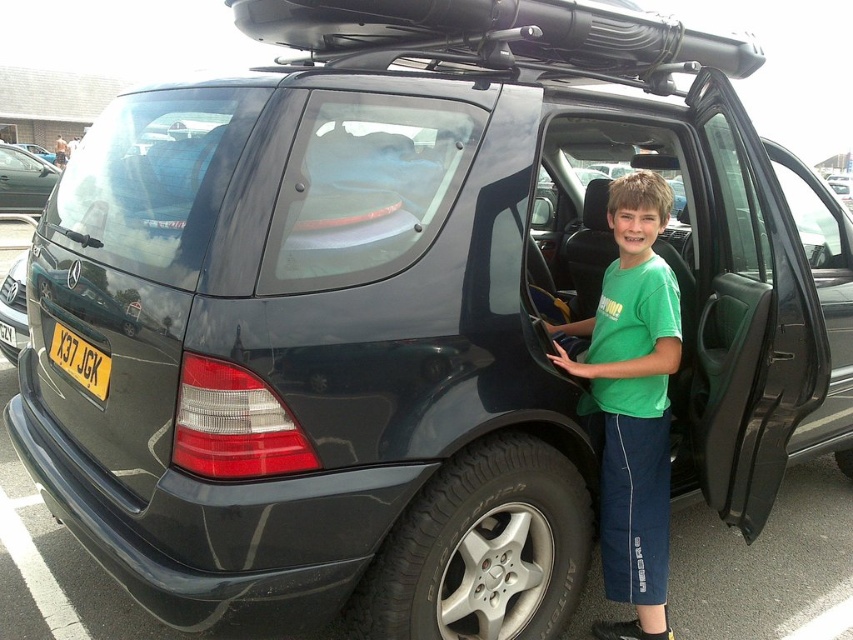
Does metallic silver car at left have a larger size compared to yellow plastic license plate at rear?

Yes.

Does point (41, 164) come farther from viewer compared to point (65, 332)?

That is True.

Which is behind, point (24, 182) or point (96, 372)?

The point (24, 182) is behind.

Identify the location of metallic silver car at left. (24, 180).

Looking at this image, does green cotton shirt at center have a lesser width compared to metallic silver car at left?

Indeed, green cotton shirt at center has a lesser width compared to metallic silver car at left.

This screenshot has width=853, height=640. Find the location of `green cotton shirt at center`. green cotton shirt at center is located at coordinates (631, 403).

The height and width of the screenshot is (640, 853). What do you see at coordinates (631, 403) in the screenshot?
I see `green cotton shirt at center` at bounding box center [631, 403].

Where is `green cotton shirt at center`? green cotton shirt at center is located at coordinates (631, 403).

Does black rubber tire at lower center appear on the right side of green cotton shirt at center?

Incorrect, black rubber tire at lower center is not on the right side of green cotton shirt at center.

Does black rubber tire at lower center have a lesser width compared to green cotton shirt at center?

In fact, black rubber tire at lower center might be wider than green cotton shirt at center.

Is point (570, 499) farther from camera compared to point (630, 388)?

No, it is in front of (630, 388).

Find the location of `black rubber tire at lower center`. black rubber tire at lower center is located at coordinates (482, 548).